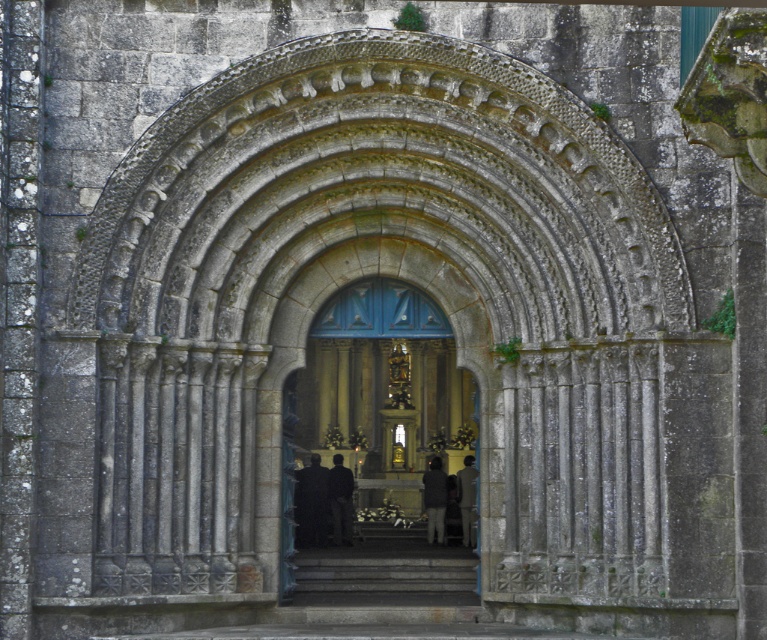
You are standing outside the archway and want to enter the blue door at the far end. There is a black fabric at center and a dark brown leather coat at center in your path. Which object do you need to step around to reach the door?

The black fabric at center is in front of the dark brown leather coat at center, so you need to step around the black fabric at center to reach the door.

You are standing in front of the grand stone archway and need to carry the dark brown leather coat at center through the gray stone stairs at center. Can you fit the coat through the stairs without any issues?

The gray stone stairs at center might be wider than dark brown leather coat at center, so there is a possibility that the coat can fit through the stairs without issues. However, the exact dimensions are uncertain based on the provided information.